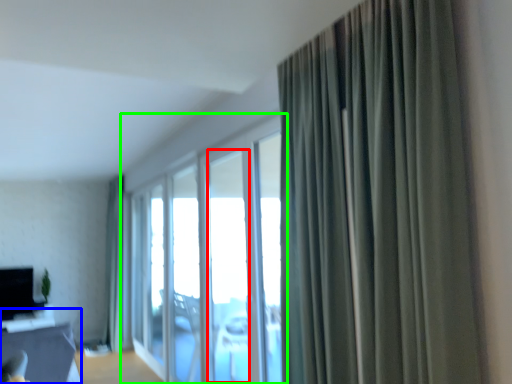
Question: Which object is positioned farthest from window (highlighted by a red box)? Select from table (highlighted by a blue box) and window (highlighted by a green box).

Choices:
 (A) table
 (B) window

Answer: (A)